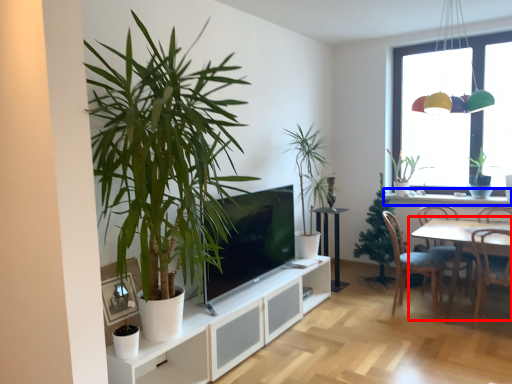
Question: Which of the following is the farthest to the observer, table (highlighted by a red box) or window sill (highlighted by a blue box)?

Choices:
 (A) table
 (B) window sill

Answer: (B)